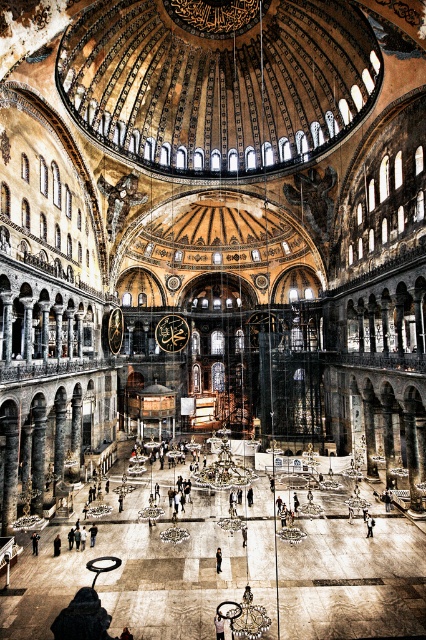
Looking at this image, you are a fashion designer observing a model wearing the dark blue jeans at center and the dark gray fabric jacket at center. Which clothing item is wider?

The dark blue jeans at center is wider than the dark gray fabric jacket at center.

Based on the photo, you are an interior designer assessing the placement of two jackets in a grand historical building. The black leather jacket at center and the dark gray fabric jacket at center are both displayed in the central area. Which jacket is positioned higher relative to the other?

The black leather jacket at center is located above the dark gray fabric jacket at center, so it is positioned higher.

Based on the photo, you are standing in the grand historical building and want to determine the relative positions of two points marked in the image. Which point is closer to you, point (371, 518) or point (216, 547)?

Point (371, 518) is closer to you because it is further to the viewer than point (216, 547).